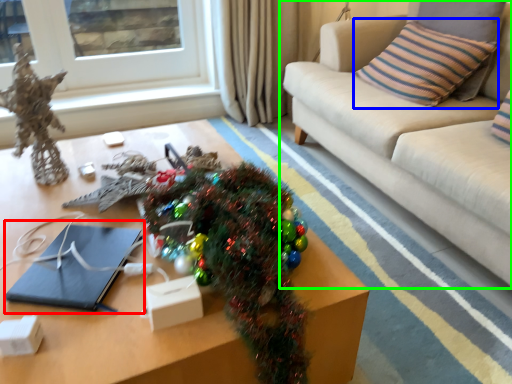
Question: Based on their relative distances, which object is farther from notebook (highlighted by a red box)? Choose from pillow (highlighted by a blue box) and studio couch (highlighted by a green box).

Choices:
 (A) pillow
 (B) studio couch

Answer: (A)